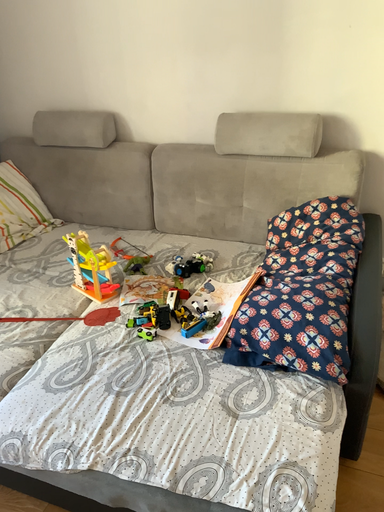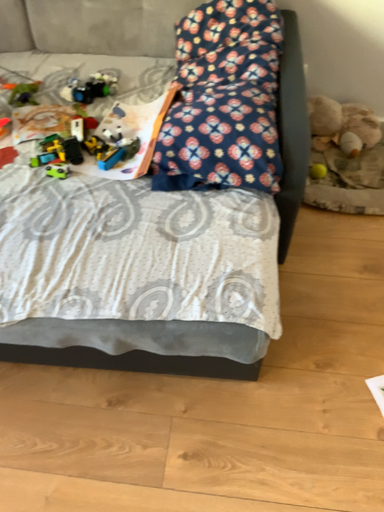
Question: How did the camera likely rotate when shooting the video?

Choices:
 (A) rotated left
 (B) rotated right

Answer: (B)